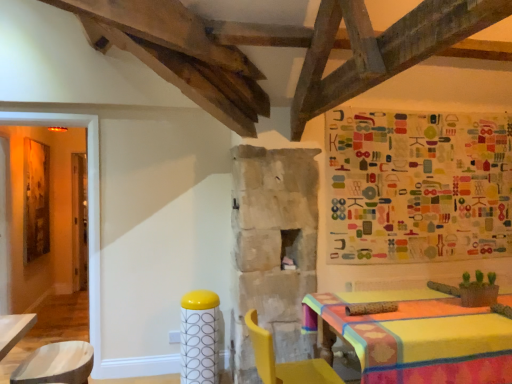
Question: Is yellow plastic chair at lower right taller or shorter than multicolored fabric tapestry at upper right?

Choices:
 (A) tall
 (B) short

Answer: (B)

Question: Is yellow plastic chair at lower right to the left or to the right of multicolored fabric tapestry at upper right in the image?

Choices:
 (A) right
 (B) left

Answer: (B)

Question: Considering the real-world distances, which object is farthest from the yellow plastic chair at lower right?

Choices:
 (A) yellow glossy bar stool at center
 (B) multicolored fabric tapestry at upper right

Answer: (B)

Question: Estimate the real-world distances between objects in this image. Which object is farther from the yellow glossy bar stool at center?

Choices:
 (A) yellow plastic chair at lower right
 (B) multicolored fabric tapestry at upper right

Answer: (B)